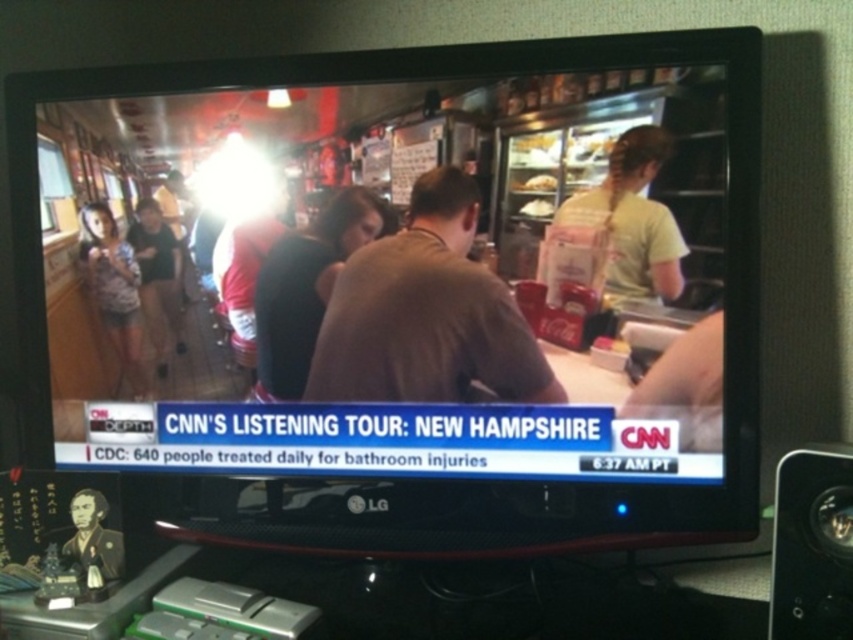
You are observing the CNN broadcast scene on the TV screen. There are two people wearing a dark brown shirt at center and a matte pink shirt at left. From the perspective of someone sitting in front of the TV, which shirt is located to the left of the other?

The matte pink shirt at left is positioned to the left of the dark brown shirt at center.

Looking at this image, you are a graphic designer asked to add a new logo to the bottom right corner of the TV screen. The current logo at point 0.853, 0.953 is a black plastic speaker at lower right. Will placing the new logo at point [811,547] interfere with the existing logo?

The point [811,547] is where the black plastic speaker at lower right is located, so placing the new logo at that exact point would overlap with the existing logo.

You are a TV technician adjusting the focus on a monitor showing the CNN broadcast. You need to center the focus on the dark brown shirt at center. What coordinates should you set the focus to?

The coordinates for the dark brown shirt at center are at point [306,285], so you should set the focus to those coordinates.